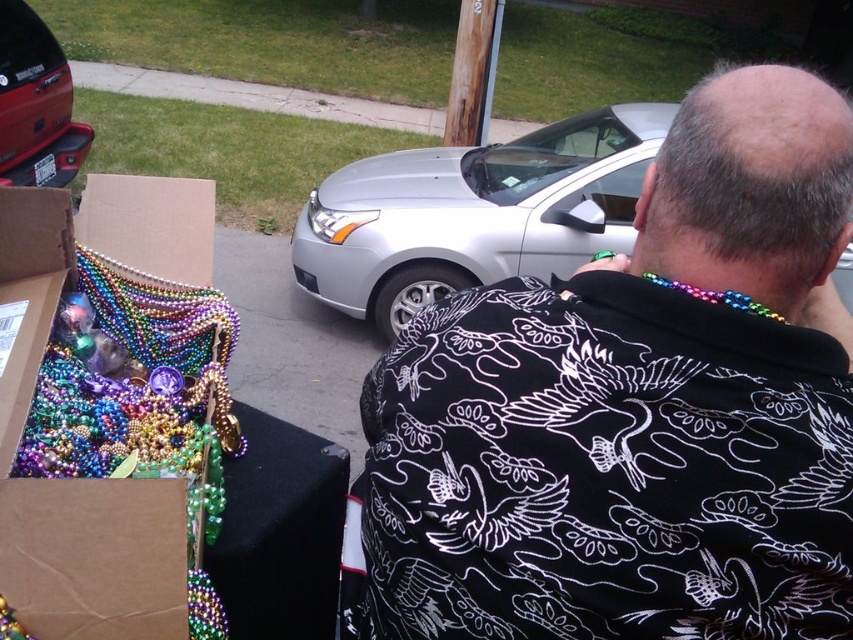
Consider the image. You are standing in front of the black printed shirt at center and want to take a photo of it without getting too close. If your camera has a maximum focus range of 24 inches, will you be able to capture a clear photo from your current position?

The black printed shirt at center and viewer are 23.77 inches apart from each other, which is within the camera maximum focus range of 24 inches. Therefore, you can capture a clear photo from your current position.

You are at a car exhibition and want to take a photo of both the silver metallic car at center and the matte red car at upper left. Since you want to include both in the same frame, which car should you stand closer to?

You should stand closer to the matte red car at upper left because the silver metallic car at center is larger in size. By moving closer to the smaller matte red car at upper left, you can balance their sizes in the photo frame.